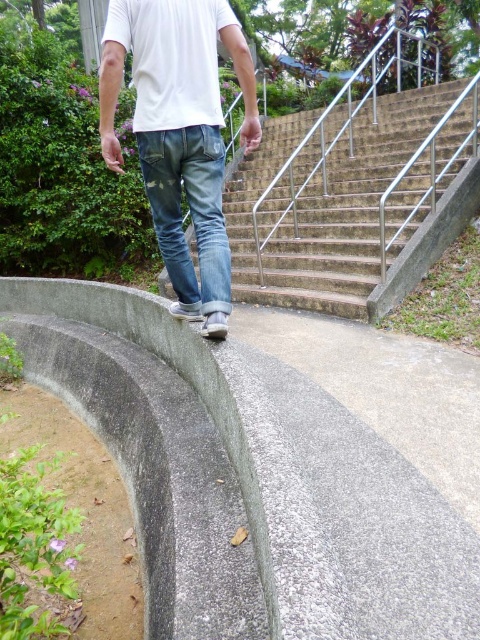
Who is lower down, denim jeans at center or denim/jeans at center?

Positioned lower is denim/jeans at center.

Is denim jeans at center above denim/jeans at center?

Yes.

Who is more distant from viewer, (192, 49) or (212, 161)?

Point (212, 161)

Find the location of a particular element. denim jeans at center is located at coordinates (180, 132).

Which is more to the left, white matte t-shirt at upper center or denim/jeans at center?

white matte t-shirt at upper center

Can you confirm if white matte t-shirt at upper center is positioned to the right of denim/jeans at center?

Incorrect, white matte t-shirt at upper center is not on the right side of denim/jeans at center.

Looking at this image, who is more distant from viewer, (164, 77) or (211, 184)?

Point (211, 184)

You are a GUI agent. You are given a task and a screenshot of the screen. Output one action in this format:
    pyautogui.click(x=<x>, y=<y>)
    Task: Click on the white matte t-shirt at upper center
    This screenshot has height=640, width=480.
    Given the screenshot: What is the action you would take?
    pyautogui.click(x=171, y=58)

Between point (269, 264) and point (196, 74), which one is positioned in front?

Point (196, 74) is in front.

Identify the location of concrete stairs at center. (327, 205).

Which is in front, point (420, 100) or point (166, 150)?

Positioned in front is point (166, 150).

You are a GUI agent. You are given a task and a screenshot of the screen. Output one action in this format:
    pyautogui.click(x=<x>, y=<y>)
    Task: Click on the concrete stairs at center
    This screenshot has width=480, height=640.
    Given the screenshot: What is the action you would take?
    pyautogui.click(x=327, y=205)